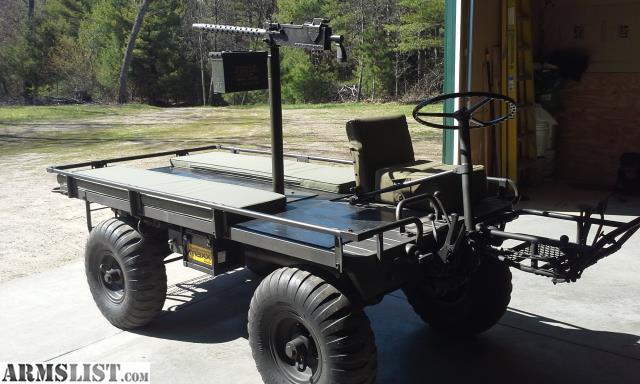
Where is `1 seat`? The width and height of the screenshot is (640, 384). 1 seat is located at coordinates (408, 175).